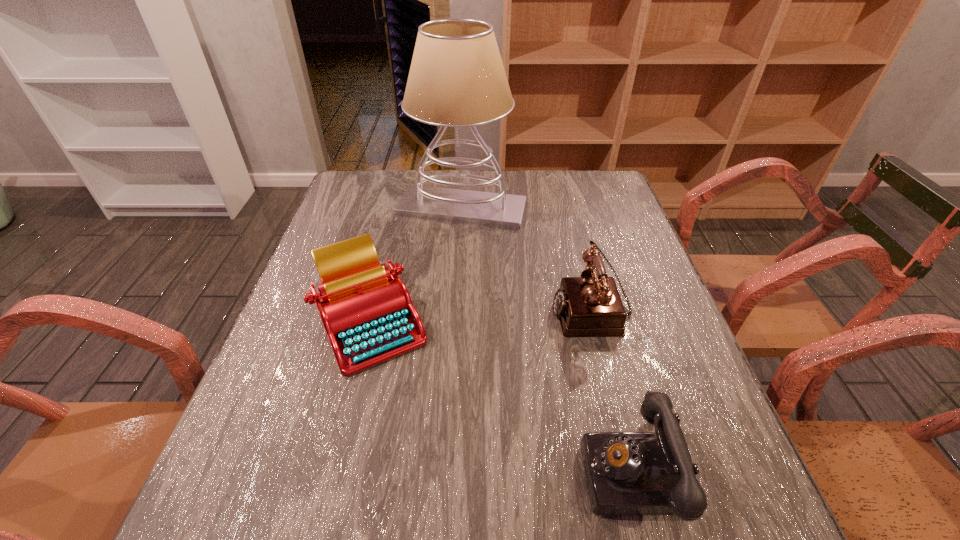
The height and width of the screenshot is (540, 960). Find the location of `the farthest object`. the farthest object is located at coordinates (457, 79).

This screenshot has height=540, width=960. Find the location of `table lamp`. table lamp is located at coordinates (457, 79).

Where is `the farther telephone`? the farther telephone is located at coordinates (588, 306).

Identify the location of typewriter. This screenshot has height=540, width=960. (367, 312).

Locate an element on the screen. vacant space located on the front of the tallest object is located at coordinates 459,252.

I want to click on free space located on the dial of the farther telephone, so click(x=431, y=309).

Where is `vacant space located on the dial of the farther telephone`? vacant space located on the dial of the farther telephone is located at coordinates (500, 309).

This screenshot has width=960, height=540. Identify the location of free space located on the dial of the farther telephone. (492, 309).

Find the location of `free space located on the typing side of the typewriter`. free space located on the typing side of the typewriter is located at coordinates (325, 502).

Find the location of a particular element. This screenshot has width=960, height=540. object that is at the far edge is located at coordinates (457, 79).